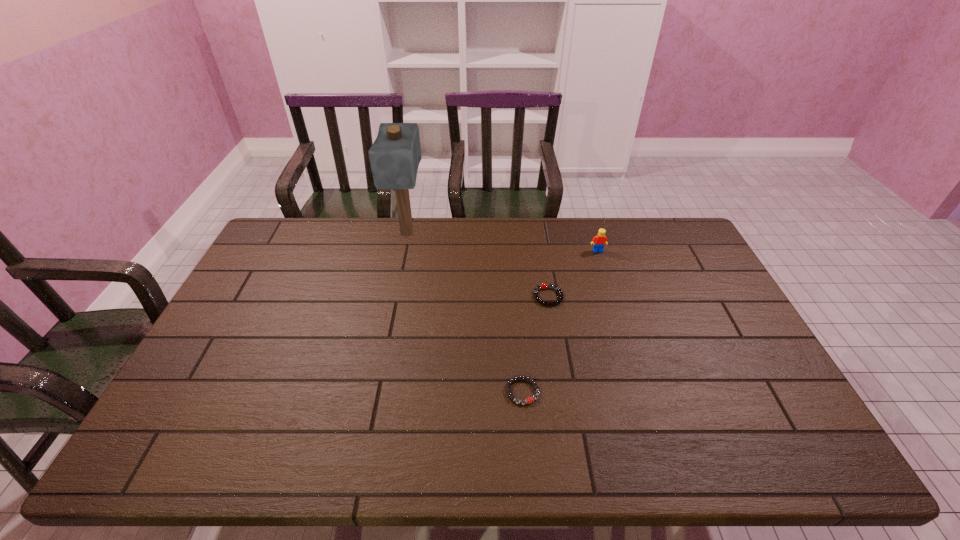
This screenshot has height=540, width=960. In order to click on the third closest object to the nearest object in this screenshot , I will do `click(395, 155)`.

Identify which object is the second nearest to the nearer bracelet. Please provide its 2D coordinates. Your answer should be formatted as a tuple, i.e. [(x, y)], where the tuple contains the x and y coordinates of a point satisfying the conditions above.

[(600, 240)]

I want to click on vacant area that satisfies the following two spatial constraints: 1. on the back side of the left bracelet; 2. on the right side of the farther bracelet, so click(x=515, y=296).

Where is `vacant space that satisfies the following two spatial constraints: 1. on the front side of the second object from right to left; 2. on the left side of the mallet`? vacant space that satisfies the following two spatial constraints: 1. on the front side of the second object from right to left; 2. on the left side of the mallet is located at coordinates (395, 296).

Locate an element on the screen. free space that satisfies the following two spatial constraints: 1. on the back side of the farther bracelet; 2. on the left side of the third object from right to left is located at coordinates (515, 296).